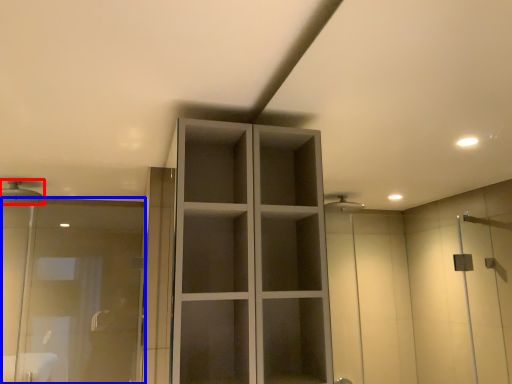
Question: Which object appears closest to the camera in this image, shower (highlighted by a red box) or screen door (highlighted by a blue box)?

Choices:
 (A) shower
 (B) screen door

Answer: (B)